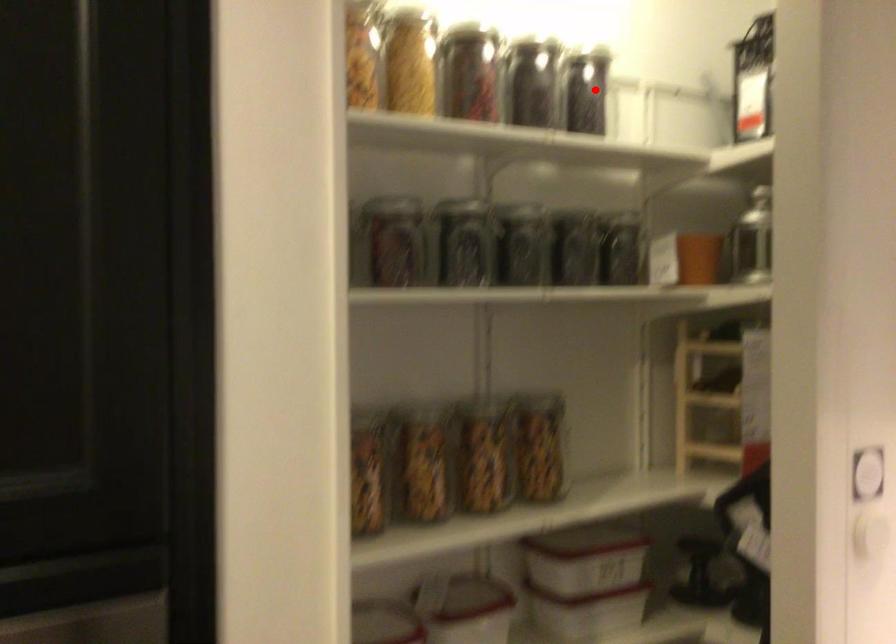
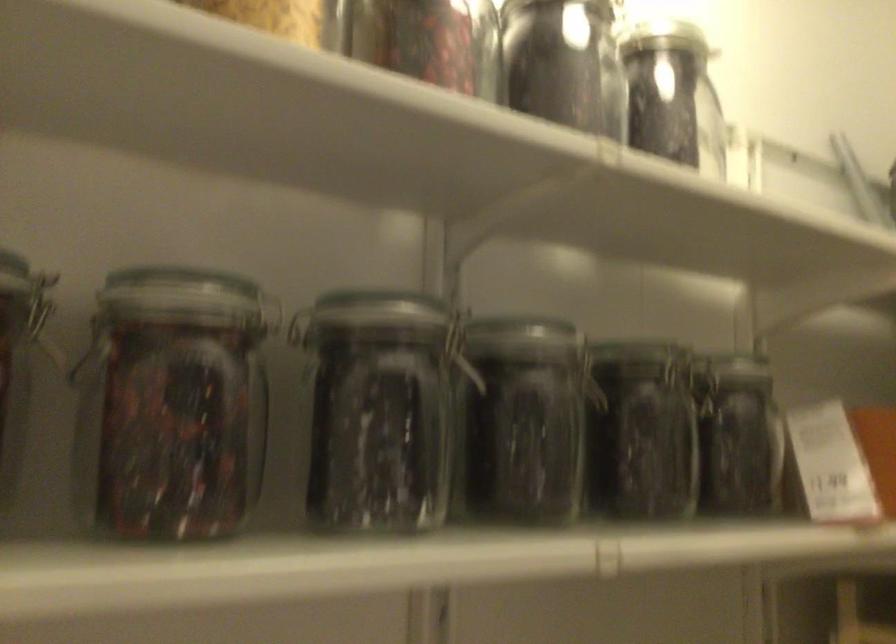
Locate, in the second image, the point that corresponds to the highlighted location in the first image.

(673, 95)